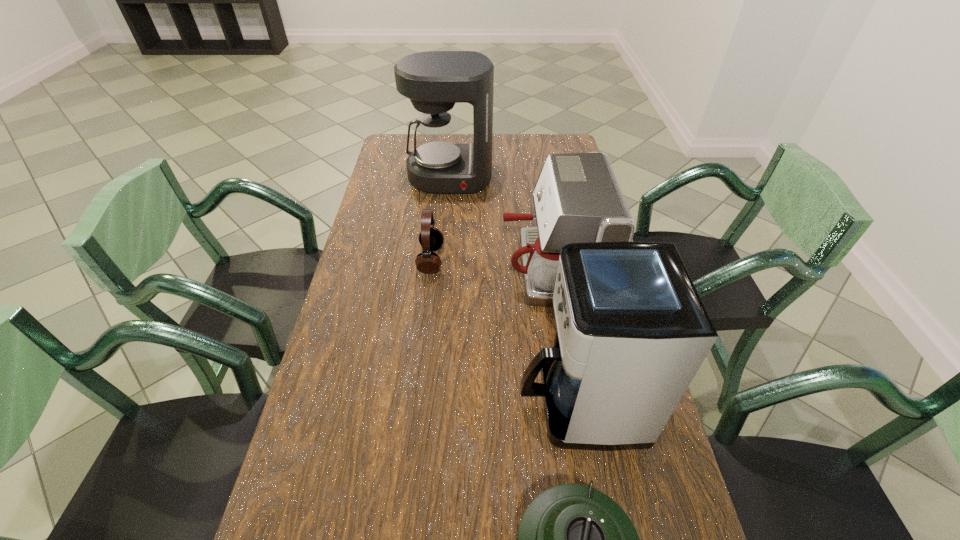
This screenshot has height=540, width=960. Find the location of `free space located 0.210m on the front of the shortest coffee maker near the spout`. free space located 0.210m on the front of the shortest coffee maker near the spout is located at coordinates coord(432,268).

Image resolution: width=960 pixels, height=540 pixels. I want to click on vacant space positioned 0.180m on the front of the shortest coffee maker near the spout, so click(x=442, y=268).

This screenshot has height=540, width=960. Find the location of `vacant space positioned 0.080m on the ear pads of the headset`. vacant space positioned 0.080m on the ear pads of the headset is located at coordinates (470, 260).

I want to click on object situated at the far edge, so click(434, 81).

Locate an element on the screen. object situated at the left edge is located at coordinates (434, 81).

Image resolution: width=960 pixels, height=540 pixels. I want to click on object that is at the far left corner, so click(x=434, y=81).

The width and height of the screenshot is (960, 540). What are the coordinates of `free location at the left edge of the desktop` in the screenshot? It's located at (395, 250).

You are a GUI agent. You are given a task and a screenshot of the screen. Output one action in this format:
    pyautogui.click(x=<x>, y=<y>)
    Task: Click on the vacant space at the far left corner
    Image resolution: width=960 pixels, height=540 pixels.
    Given the screenshot: What is the action you would take?
    pyautogui.click(x=387, y=162)

Where is `free space that is in between the headset and the second farthest coffee maker`? The height and width of the screenshot is (540, 960). free space that is in between the headset and the second farthest coffee maker is located at coordinates (491, 264).

Where is `free space between the shortest object and the shortest coffee maker`? The height and width of the screenshot is (540, 960). free space between the shortest object and the shortest coffee maker is located at coordinates (491, 264).